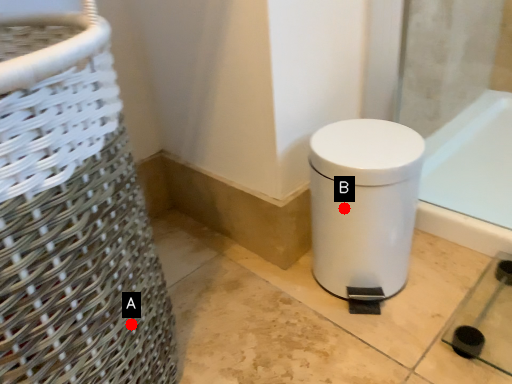
Question: Two points are circled on the image, labeled by A and B beside each circle. Which point is farther from the camera taking this photo?

Choices:
 (A) A is further
 (B) B is further

Answer: (B)